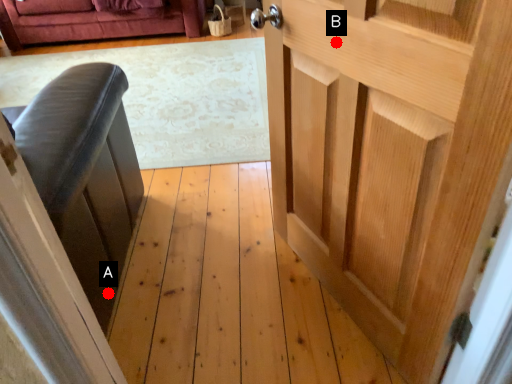
Question: Two points are circled on the image, labeled by A and B beside each circle. Which point appears closest to the camera in this image?

Choices:
 (A) A is closer
 (B) B is closer

Answer: (B)